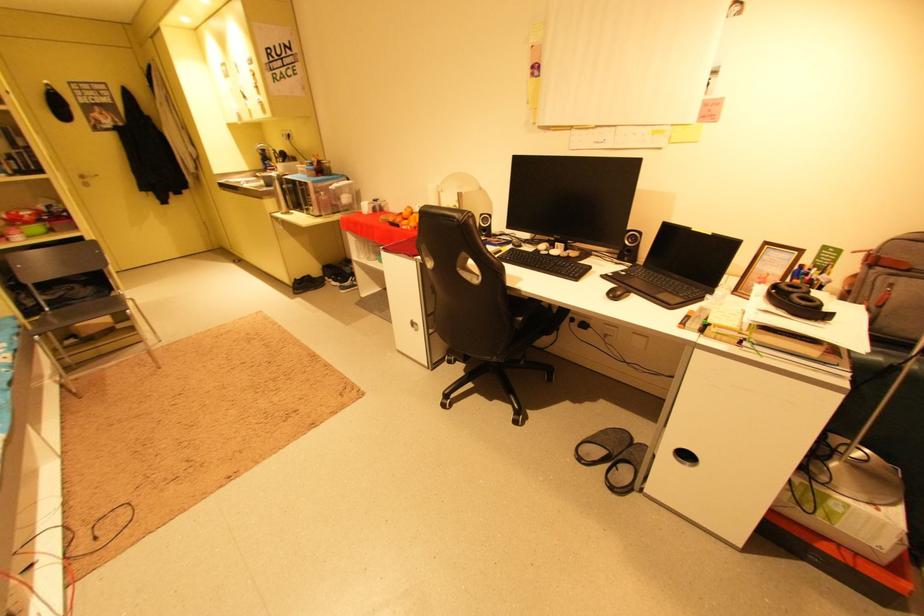
Describe the element at coordinates (45, 582) in the screenshot. I see `the red zipper pull` at that location.